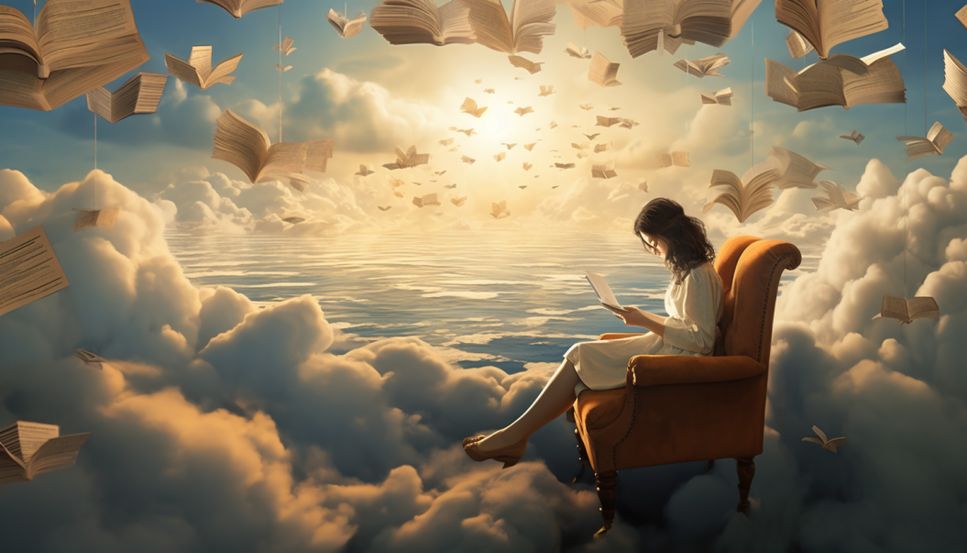
I want to click on chair leg, so click(x=604, y=519).